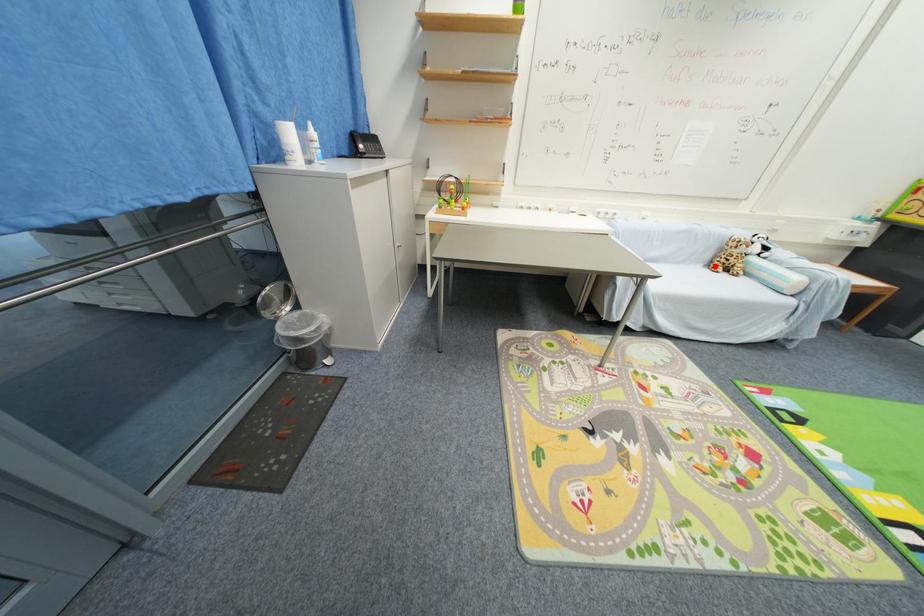
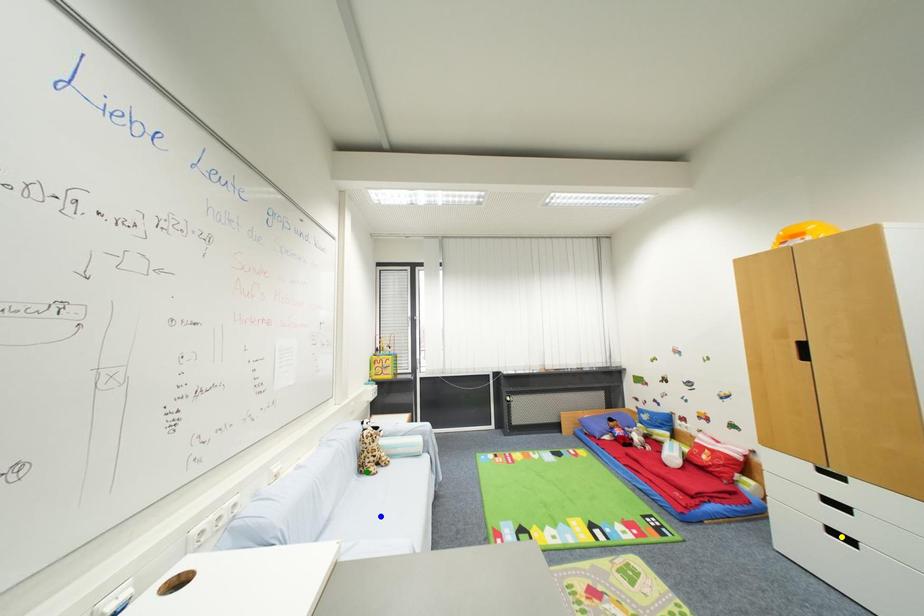
Question: I am providing you with two images of the same scene from different viewpoints. A red point is marked on the first image. You are given multiple points on the second image. Which spot in image 2 lines up with the point in image 1?

Choices:
 (A) blue point
 (B) yellow point
 (C) green point

Answer: (C)